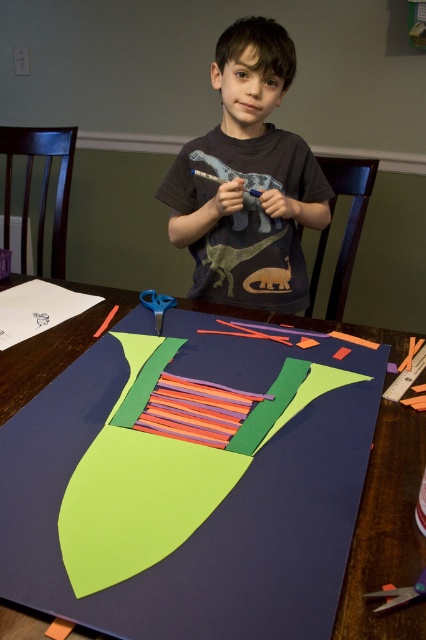
Question: Can you confirm if matte blue paper at center is positioned to the right of metallic silver scissors at lower right?

Choices:
 (A) yes
 (B) no

Answer: (B)

Question: Estimate the real-world distances between objects in this image. Which object is farther from the matte blue paper at center?

Choices:
 (A) blue plastic scissors at upper center
 (B) dark gray t-shirt at center
 (C) metallic silver scissors at lower right

Answer: (C)

Question: Does matte blue paper at center have a greater width compared to blue plastic scissors at upper center?

Choices:
 (A) no
 (B) yes

Answer: (B)

Question: Which point is farther to the camera?

Choices:
 (A) (284, 60)
 (B) (66, 339)

Answer: (A)

Question: In this image, where is matte blue paper at center located relative to blue plastic scissors at upper center?

Choices:
 (A) below
 (B) above

Answer: (A)

Question: Which object appears farthest from the camera in this image?

Choices:
 (A) dark gray t-shirt at center
 (B) blue plastic scissors at upper center
 (C) matte blue paper at center
 (D) metallic silver scissors at lower right

Answer: (A)